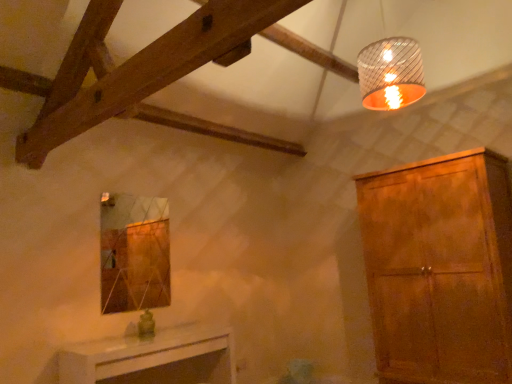
Question: Can you confirm if matte brown cabinet at right is bigger than metallic ribbed lampshade at upper right?

Choices:
 (A) yes
 (B) no

Answer: (A)

Question: Could you tell me if matte brown cabinet at right is facing metallic ribbed lampshade at upper right?

Choices:
 (A) no
 (B) yes

Answer: (A)

Question: Is matte brown cabinet at right positioned beyond the bounds of metallic ribbed lampshade at upper right?

Choices:
 (A) no
 (B) yes

Answer: (B)

Question: Considering the relative positions of matte brown cabinet at right and metallic ribbed lampshade at upper right in the image provided, is matte brown cabinet at right behind metallic ribbed lampshade at upper right?

Choices:
 (A) no
 (B) yes

Answer: (B)

Question: From the image's perspective, is matte brown cabinet at right below metallic ribbed lampshade at upper right?

Choices:
 (A) yes
 (B) no

Answer: (A)

Question: From a real-world perspective, is white glossy table at lower center above or below matte brown cabinet at right?

Choices:
 (A) below
 (B) above

Answer: (A)

Question: In the image, is white glossy table at lower center positioned in front of or behind matte brown cabinet at right?

Choices:
 (A) front
 (B) behind

Answer: (A)

Question: Considering the positions of white glossy table at lower center and matte brown cabinet at right in the image, is white glossy table at lower center wider or thinner than matte brown cabinet at right?

Choices:
 (A) thin
 (B) wide

Answer: (A)

Question: Does point (72, 357) appear closer or farther from the camera than point (394, 322)?

Choices:
 (A) closer
 (B) farther

Answer: (A)

Question: Does point (60, 362) appear closer or farther from the camera than point (358, 51)?

Choices:
 (A) farther
 (B) closer

Answer: (A)

Question: In the image, is white glossy table at lower center on the left side or the right side of metallic ribbed lampshade at upper right?

Choices:
 (A) left
 (B) right

Answer: (A)

Question: From a real-world perspective, relative to metallic ribbed lampshade at upper right, is white glossy table at lower center vertically above or below?

Choices:
 (A) above
 (B) below

Answer: (B)

Question: From their relative heights in the image, would you say white glossy table at lower center is taller or shorter than metallic ribbed lampshade at upper right?

Choices:
 (A) short
 (B) tall

Answer: (A)

Question: From a real-world perspective, is matte brown cabinet at right physically located above or below white glossy table at lower center?

Choices:
 (A) below
 (B) above

Answer: (B)

Question: Relative to white glossy table at lower center, is matte brown cabinet at right in front or behind?

Choices:
 (A) behind
 (B) front

Answer: (A)